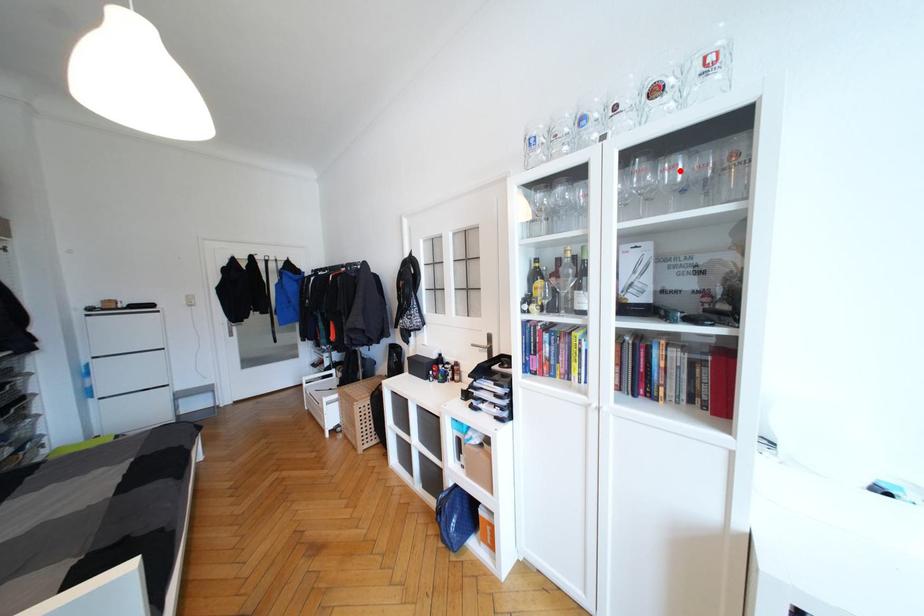
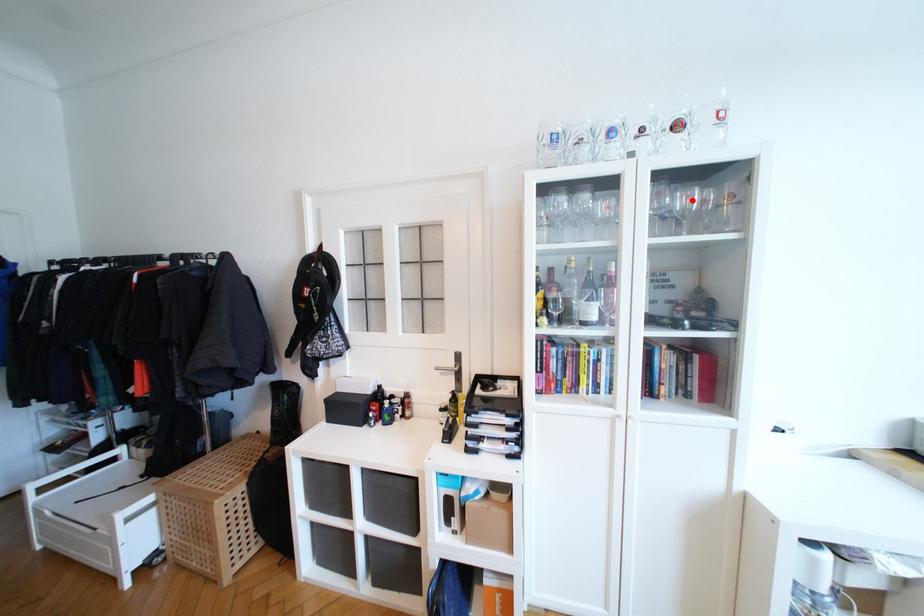
I am providing you with two images of the same scene from different viewpoints. A red point is marked on the first image and another point is marked on the second image. Is the red point in image1 aligned with the point shown in image2?

Yes